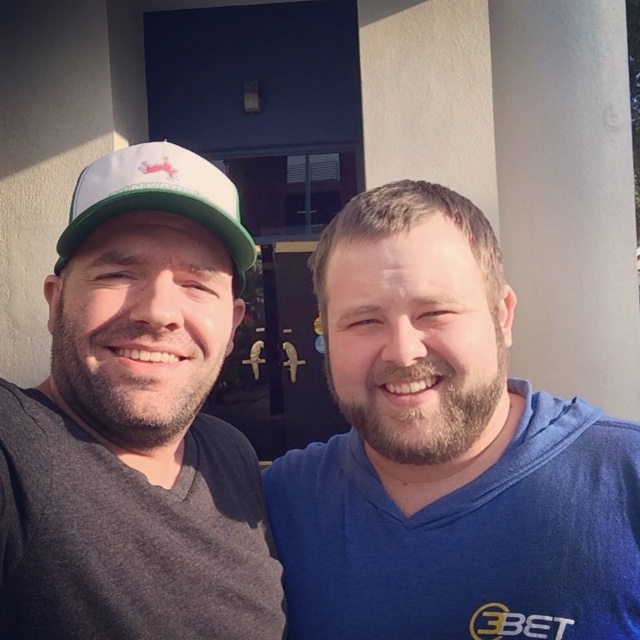
Question: Does gray matte cap at left lie in front of white fabric baseball cap at left?

Choices:
 (A) yes
 (B) no

Answer: (A)

Question: Can you confirm if gray matte cap at left is positioned to the left of white fabric baseball cap at left?

Choices:
 (A) yes
 (B) no

Answer: (A)

Question: Which of the following is the farthest from the observer?

Choices:
 (A) (312, 634)
 (B) (220, 189)

Answer: (A)

Question: Among these points, which one is nearest to the camera?

Choices:
 (A) (602, 422)
 (B) (132, 198)
 (C) (150, 461)

Answer: (B)

Question: Does blue cotton shirt at center appear over gray matte cap at left?

Choices:
 (A) no
 (B) yes

Answer: (A)

Question: Among these objects, which one is farthest from the camera?

Choices:
 (A) white fabric baseball cap at left
 (B) blue cotton shirt at center

Answer: (B)